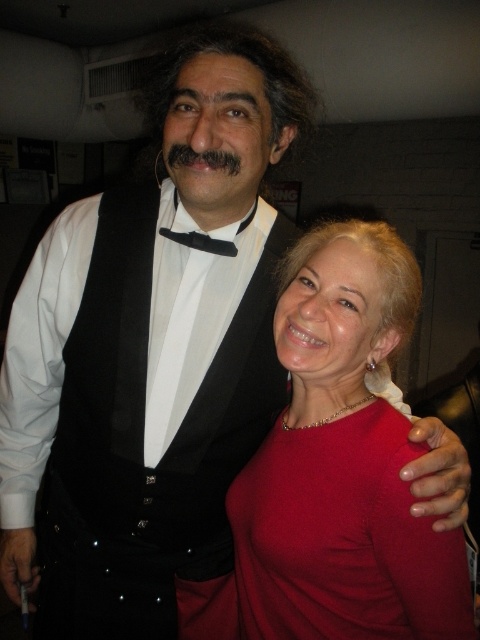
Question: Can you confirm if matte red dress at center is positioned to the left of black satin bow tie at center?

Choices:
 (A) no
 (B) yes

Answer: (A)

Question: Which point is closer to the camera taking this photo?

Choices:
 (A) (387, 312)
 (B) (173, 164)

Answer: (B)

Question: Among these points, which one is nearest to the camera?

Choices:
 (A) (178, 241)
 (B) (200, 163)

Answer: (B)

Question: Is black fuzzy mustache at center to the right of black satin bow tie at center from the viewer's perspective?

Choices:
 (A) yes
 (B) no

Answer: (A)

Question: Which of these objects is positioned closest to the black satin bow tie at center?

Choices:
 (A) matte red dress at center
 (B) black fuzzy mustache at center

Answer: (B)

Question: Does matte red dress at center appear over black fuzzy mustache at center?

Choices:
 (A) no
 (B) yes

Answer: (A)